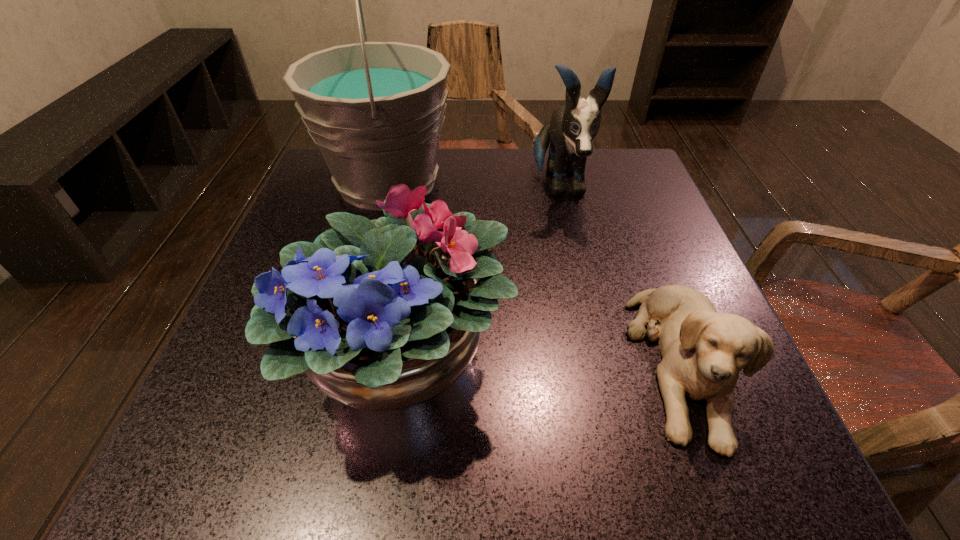
The height and width of the screenshot is (540, 960). In order to click on bouquet that is at the near edge in this screenshot , I will do `click(385, 315)`.

Where is `puppy that is at the near edge`? puppy that is at the near edge is located at coordinates (703, 351).

Locate an element on the screen. The image size is (960, 540). bucket located at the left edge is located at coordinates (375, 110).

Identify the location of bouquet at the left edge. The image size is (960, 540). (385, 315).

The image size is (960, 540). I want to click on object that is at the far left corner, so click(375, 110).

At what (x,y) coordinates should I click in order to perform the action: click on object that is at the near left corner. Please return your answer as a coordinate pair (x, y). The image size is (960, 540). Looking at the image, I should click on (385, 315).

Where is `object that is positioned at the far right corner`? This screenshot has width=960, height=540. object that is positioned at the far right corner is located at coordinates (572, 129).

This screenshot has width=960, height=540. What are the coordinates of `object present at the near right corner` in the screenshot? It's located at (703, 351).

At what (x,y) coordinates should I click in order to perform the action: click on free space at the left edge of the desktop. Please return your answer as a coordinate pair (x, y). This screenshot has height=540, width=960. Looking at the image, I should click on (342, 206).

This screenshot has width=960, height=540. Find the location of `vacant space at the right edge of the desktop`. vacant space at the right edge of the desktop is located at coordinates (667, 242).